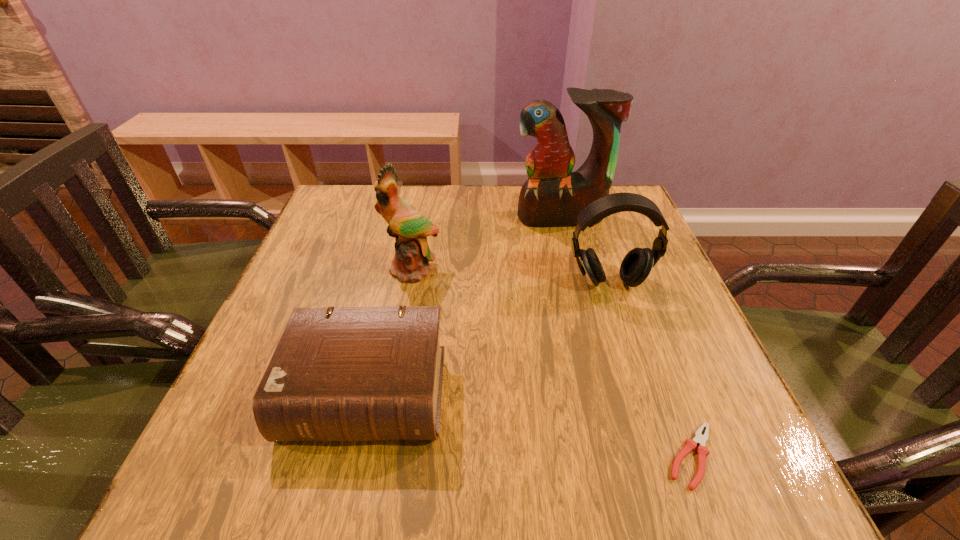
The height and width of the screenshot is (540, 960). Identify the location of object situated at the near right corner. (690, 444).

In the image, there is a desktop. Identify the location of free space at the far edge. This screenshot has width=960, height=540. (441, 197).

Find the location of a particular element. vacant space at the near edge of the desktop is located at coordinates (567, 446).

This screenshot has height=540, width=960. What are the coordinates of `vacant space at the left edge` in the screenshot? It's located at (343, 241).

You are a GUI agent. You are given a task and a screenshot of the screen. Output one action in this format:
    pyautogui.click(x=<x>, y=<y>)
    Task: Click on the vacant space at the right edge
    The height and width of the screenshot is (540, 960).
    Given the screenshot: What is the action you would take?
    pyautogui.click(x=677, y=437)

I want to click on vacant space at the far left corner of the desktop, so click(x=354, y=200).

Where is `vacant space at the near left corner of the desktop`? vacant space at the near left corner of the desktop is located at coordinates (305, 449).

The height and width of the screenshot is (540, 960). In order to click on free space at the near right corner in this screenshot , I will do `click(698, 466)`.

At what (x,y) coordinates should I click in order to perform the action: click on empty location between the nearer parrot and the shortest object. Please return your answer as a coordinate pair (x, y). Looking at the image, I should click on (552, 363).

This screenshot has width=960, height=540. I want to click on vacant region between the pliers and the nearer parrot, so click(x=552, y=363).